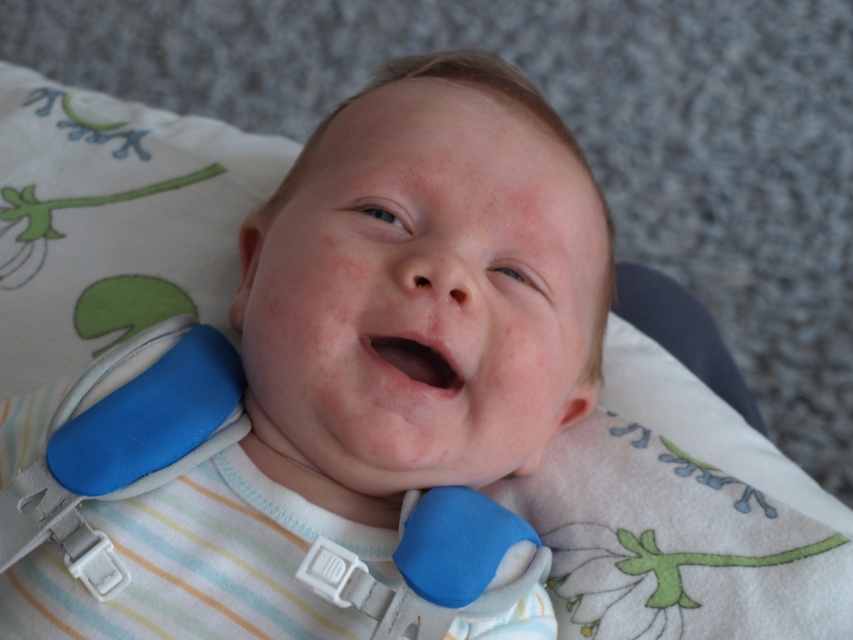
You are a pediatric nurse checking the baby in the image. You notice the blue foam baby at center and the smooth pink flesh at center. Which part of the baby is taller?

The blue foam baby at center is much taller than the smooth pink flesh at center.

You are a photographer taking a close up of a baby. You notice two points on the image at coordinates point (305, 484) and point (100, 538). Which point is closer to the camera?

Point (305, 484) is further to the camera than point (100, 538), so the point closer to the camera is point (100, 538).